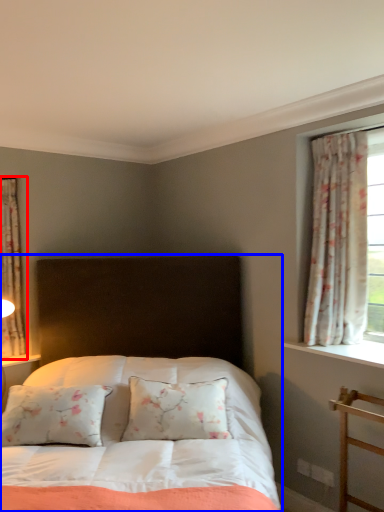
Question: Which point is closer to the camera, curtain (highlighted by a red box) or bed (highlighted by a blue box)?

Choices:
 (A) curtain
 (B) bed

Answer: (B)